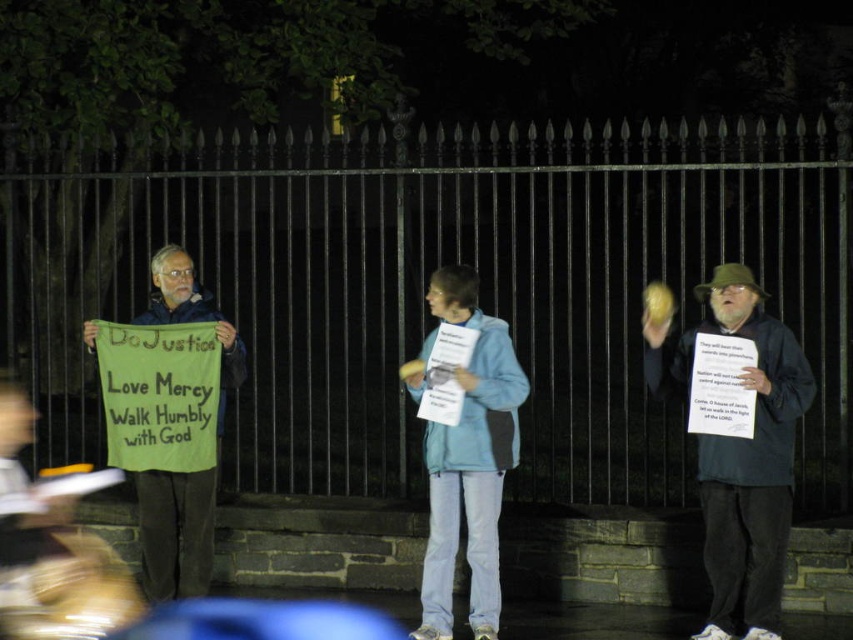
Which is in front, point (704, 481) or point (426, 346)?

Point (704, 481) is in front.

Does point (679, 337) lie behind point (492, 620)?

That is True.

You are a GUI agent. You are given a task and a screenshot of the screen. Output one action in this format:
    pyautogui.click(x=<x>, y=<y>)
    Task: Click on the blue fabric sign at right
    The image size is (853, 640).
    Given the screenshot: What is the action you would take?
    pyautogui.click(x=741, y=452)

Between point (448, 586) and point (155, 300), which one is positioned in front?

Positioned in front is point (448, 586).

Where is `blue fabric sign at center`? This screenshot has height=640, width=853. blue fabric sign at center is located at coordinates (469, 461).

Who is more distant from viewer, (x=711, y=627) or (x=210, y=570)?

The point (x=210, y=570) is more distant.

Is blue fabric sign at right below green fabric sign at left?

Yes, blue fabric sign at right is below green fabric sign at left.

The width and height of the screenshot is (853, 640). In order to click on blue fabric sign at right in this screenshot , I will do `click(741, 452)`.